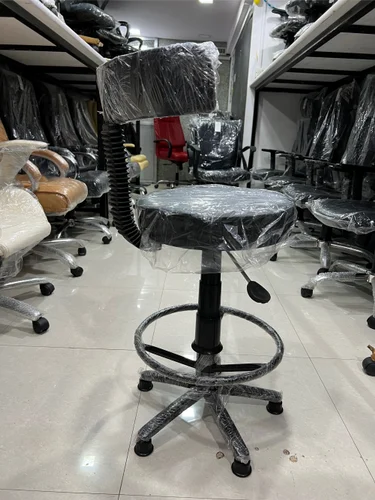
Where is `white chair`? The height and width of the screenshot is (500, 375). white chair is located at coordinates (27, 210).